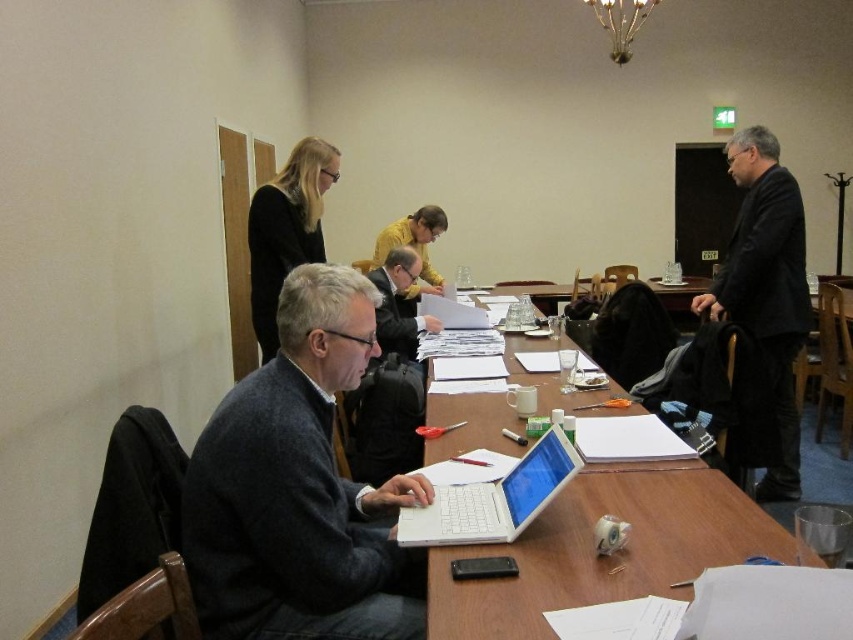
Is black matte sweater at upper center taller than dark gray sweater at center?

Yes, black matte sweater at upper center is taller than dark gray sweater at center.

Who is more distant from viewer, (305, 148) or (430, 321)?

The point (430, 321) is behind.

The image size is (853, 640). In order to click on black matte sweater at upper center in this screenshot , I will do `click(286, 230)`.

Where is `white plastic laptop at center`? The image size is (853, 640). white plastic laptop at center is located at coordinates (492, 499).

Looking at this image, which is more to the left, white plastic laptop at center or yellow sweater at center?

yellow sweater at center is more to the left.

Which is behind, point (553, 426) or point (434, 228)?

Positioned behind is point (434, 228).

The width and height of the screenshot is (853, 640). I want to click on white plastic laptop at center, so click(x=492, y=499).

Describe the element at coordinates (299, 488) in the screenshot. I see `gray wool sweater at center` at that location.

Who is positioned more to the right, gray wool sweater at center or white glossy table at center?

white glossy table at center is more to the right.

The image size is (853, 640). What are the coordinates of `gray wool sweater at center` in the screenshot? It's located at (299, 488).

Where is `gray wool sweater at center`? gray wool sweater at center is located at coordinates (299, 488).